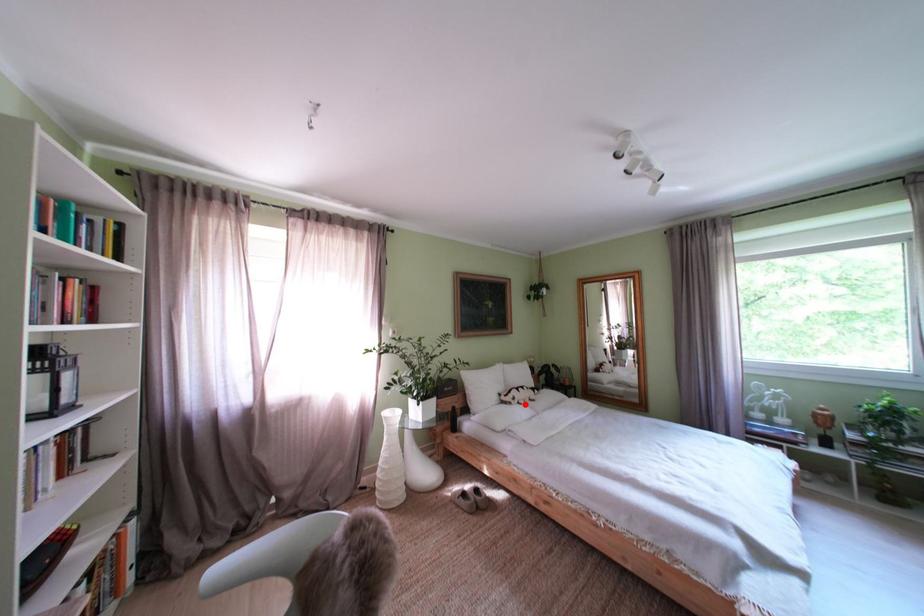
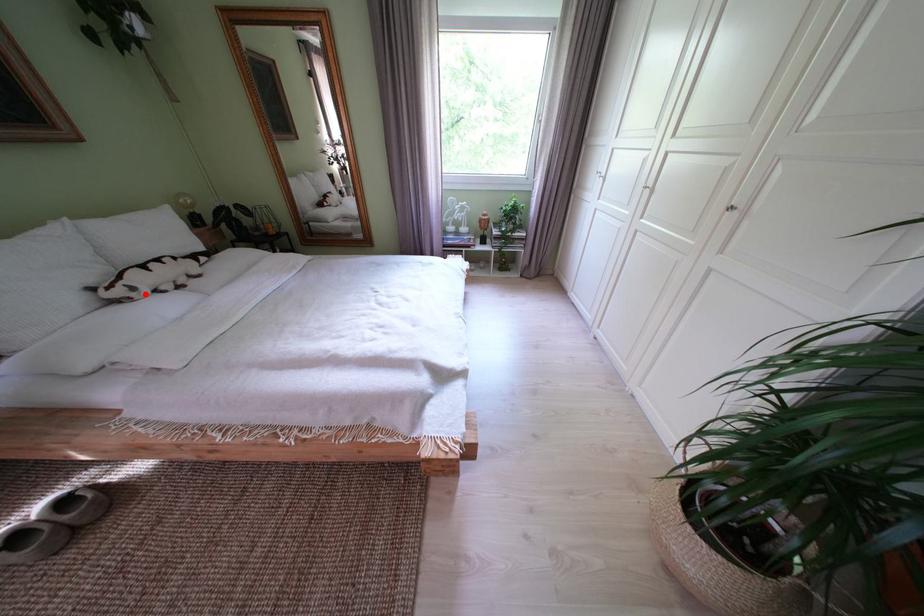
I am providing you with two images of the same scene from different viewpoints. A red point is marked on the first image and another point is marked on the second image. Is the marked point in image1 the same physical position as the marked point in image2?

Yes